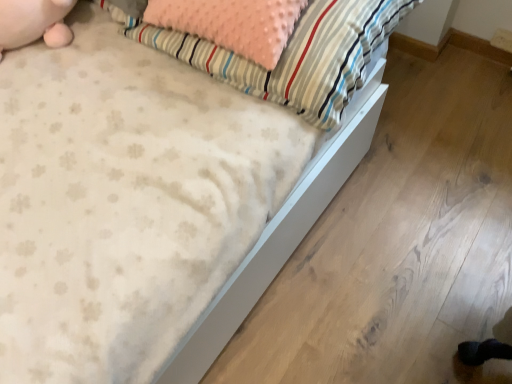
Question: From a real-world perspective, is fluffy pink pillow at upper center located higher than pink plush toy at upper left?

Choices:
 (A) yes
 (B) no

Answer: (B)

Question: From a real-world perspective, is fluffy pink pillow at upper center below pink plush toy at upper left?

Choices:
 (A) no
 (B) yes

Answer: (B)

Question: Does fluffy pink pillow at upper center have a larger size compared to pink plush toy at upper left?

Choices:
 (A) no
 (B) yes

Answer: (B)

Question: Does fluffy pink pillow at upper center have a greater width compared to pink plush toy at upper left?

Choices:
 (A) yes
 (B) no

Answer: (A)

Question: Can we say fluffy pink pillow at upper center lies outside pink plush toy at upper left?

Choices:
 (A) no
 (B) yes

Answer: (B)

Question: From the image's perspective, does fluffy pink pillow at upper center appear higher than pink plush toy at upper left?

Choices:
 (A) no
 (B) yes

Answer: (A)

Question: From a real-world perspective, is pink plush toy at upper left physically above fluffy pink pillow at upper center?

Choices:
 (A) yes
 (B) no

Answer: (A)

Question: Is pink plush toy at upper left aimed at fluffy pink pillow at upper center?

Choices:
 (A) yes
 (B) no

Answer: (B)

Question: Does pink plush toy at upper left appear on the left side of fluffy pink pillow at upper center?

Choices:
 (A) yes
 (B) no

Answer: (A)

Question: Considering the relative sizes of pink plush toy at upper left and fluffy pink pillow at upper center in the image provided, is pink plush toy at upper left taller than fluffy pink pillow at upper center?

Choices:
 (A) no
 (B) yes

Answer: (A)

Question: Is pink plush toy at upper left wider than fluffy pink pillow at upper center?

Choices:
 (A) no
 (B) yes

Answer: (A)

Question: From the image's perspective, is pink plush toy at upper left below fluffy pink pillow at upper center?

Choices:
 (A) no
 (B) yes

Answer: (A)

Question: Considering the positions of fluffy pink pillow at upper center and pink plush toy at upper left in the image, is fluffy pink pillow at upper center taller or shorter than pink plush toy at upper left?

Choices:
 (A) short
 (B) tall

Answer: (B)